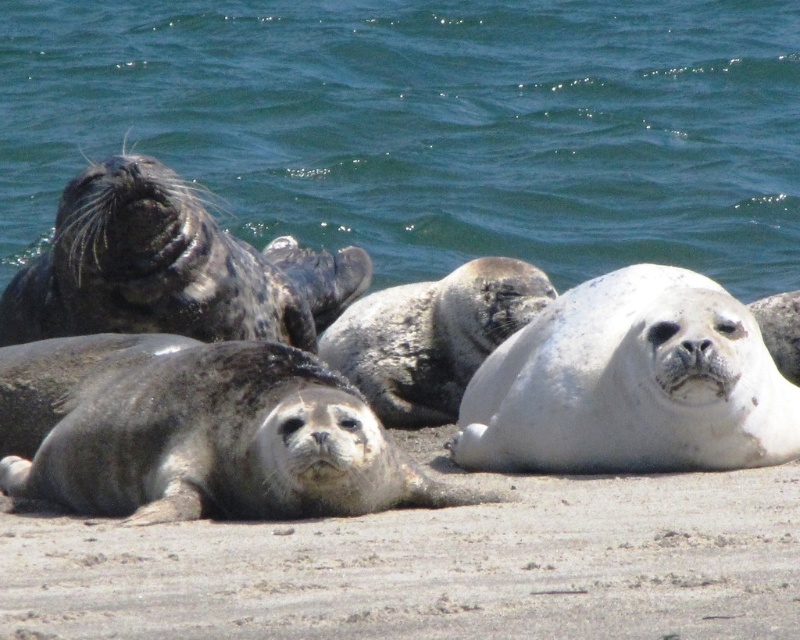
You are a photographer standing on the beach and want to capture a photo that includes both the green water at upper left and the sandy brown at lower center. Based on their heights in the image, which one will appear taller in the photo?

The green water at upper left appears taller in the photo because it has a greater height compared to the sandy brown at lower center according to the description.

You are standing on the beach where the seals are resting. You want to take a photo of the green water at upper left without moving closer than 60 feet. Is the distance sufficient?

The green water at upper left is 58.69 feet away from viewer. Since 58.69 feet is less than 60 feet, the distance is not sufficient to take the photo without moving closer than 60 feet.

You are standing on the beach and want to take a photo of the green water at upper left. Where exactly should you aim your camera?

You should aim your camera at point [428,125] to capture the green water at upper left.